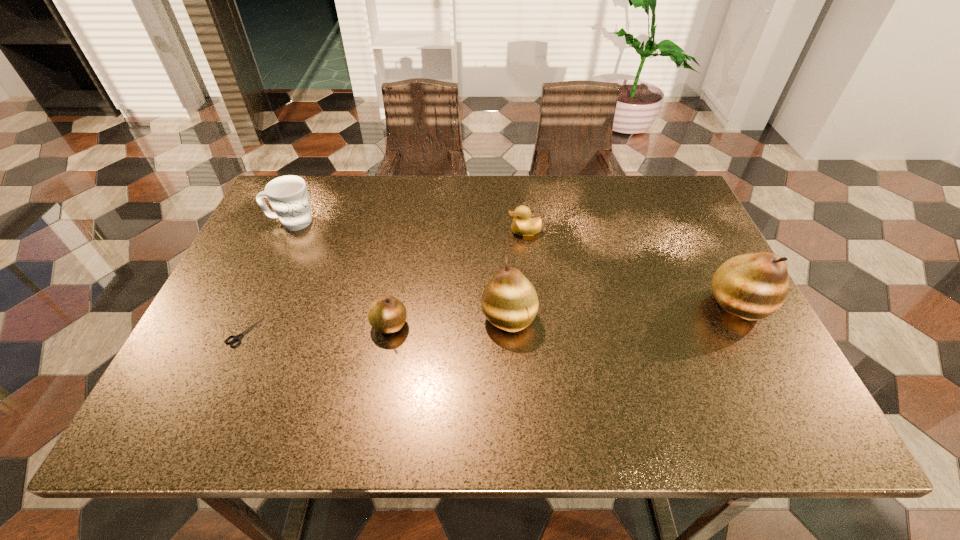
You are a GUI agent. You are given a task and a screenshot of the screen. Output one action in this format:
    pyautogui.click(x=<x>, y=<y>)
    Task: Click on the free space that satisfies the following two spatial constraints: 1. facing forward on the rightmost pear; 2. on the left side of the duckling
    The image size is (960, 540).
    Given the screenshot: What is the action you would take?
    pyautogui.click(x=533, y=305)

This screenshot has height=540, width=960. I want to click on free space that satisfies the following two spatial constraints: 1. on the side of the fifth shortest object with the handle; 2. on the left side of the mug, so tap(247, 318).

You are a GUI agent. You are given a task and a screenshot of the screen. Output one action in this format:
    pyautogui.click(x=<x>, y=<y>)
    Task: Click on the free space that satisfies the following two spatial constraints: 1. on the side of the shears with the handle; 2. on the right side of the mug
    This screenshot has height=540, width=960.
    Given the screenshot: What is the action you would take?
    pyautogui.click(x=240, y=332)

Identify the location of free region that satisfies the following two spatial constraints: 1. on the side of the mug with the handle; 2. on the right side of the rightmost pear. The width and height of the screenshot is (960, 540). (253, 305).

This screenshot has height=540, width=960. What are the coordinates of `free spot that satisfies the following two spatial constraints: 1. facing forward on the duckling; 2. on the front side of the shortest object` in the screenshot? It's located at tap(536, 332).

Locate an element on the screen. blank area in the image that satisfies the following two spatial constraints: 1. on the side of the leftmost pear with the handle; 2. on the right side of the mug is located at coordinates (244, 325).

This screenshot has height=540, width=960. Identify the location of free space that satisfies the following two spatial constraints: 1. on the side of the mug with the handle; 2. on the right side of the rightmost object. (253, 305).

Image resolution: width=960 pixels, height=540 pixels. In order to click on blank space that satisfies the following two spatial constraints: 1. facing forward on the duckling; 2. on the right side of the rightmost pear in this screenshot , I will do `click(533, 305)`.